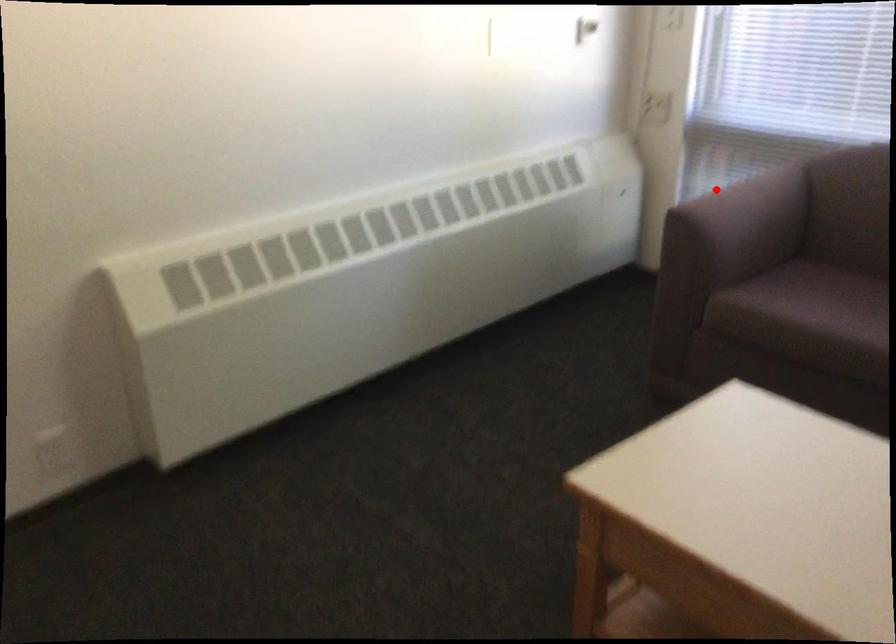
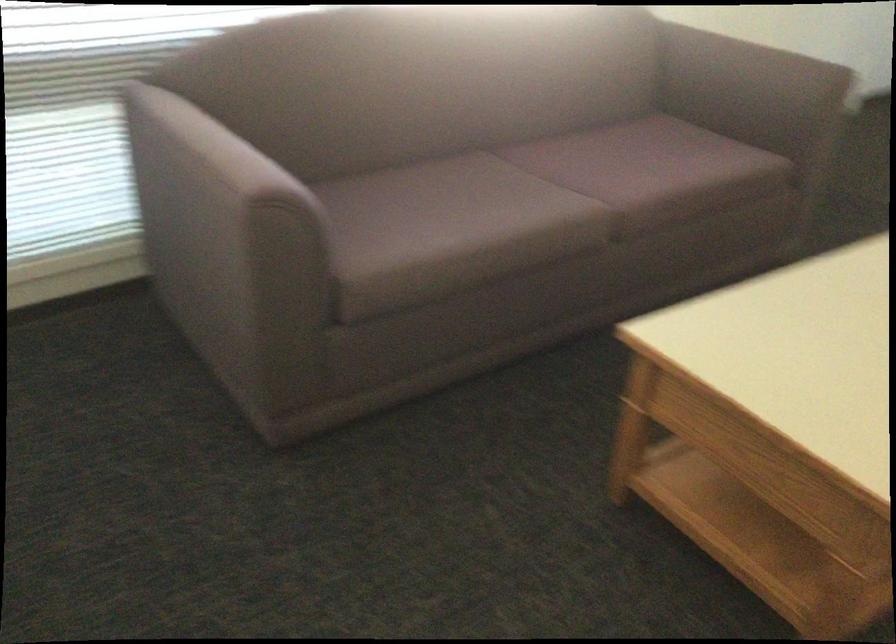
Locate, in the second image, the point that corresponds to the highlighted location in the first image.

(216, 147)